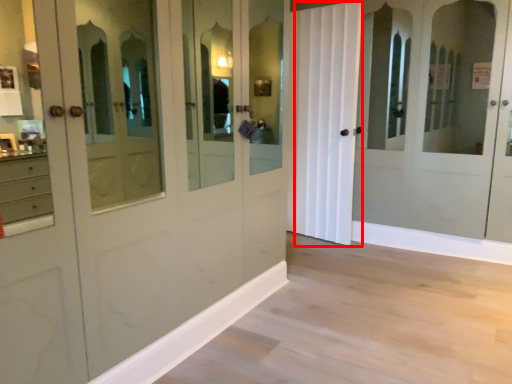
Question: Considering the relative positions of curtain (annotated by the red box) and molding in the image provided, where is curtain (annotated by the red box) located with respect to the staircase?

Choices:
 (A) right
 (B) left

Answer: (A)